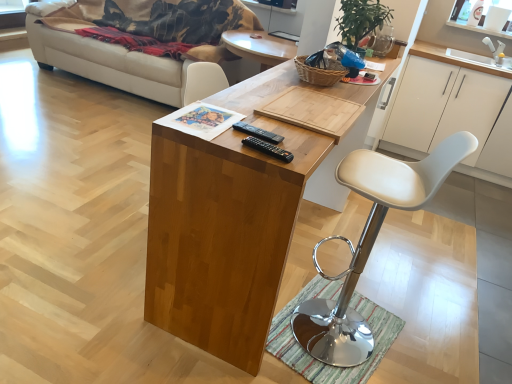
The height and width of the screenshot is (384, 512). I want to click on vacant space behind black plastic remote at center, the 1th remote in the front-to-back sequence, so click(x=271, y=130).